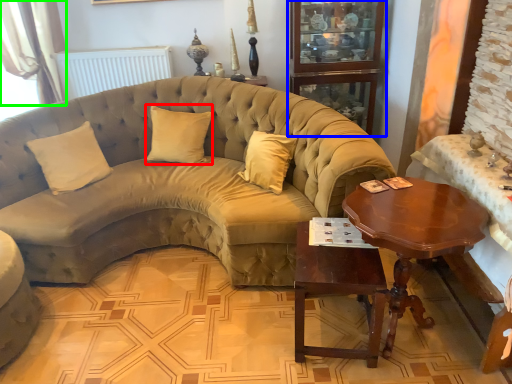
Question: Which is farther away from pillow (highlighted by a red box)? bookshelf (highlighted by a blue box) or curtain (highlighted by a green box)?

Choices:
 (A) bookshelf
 (B) curtain

Answer: (B)